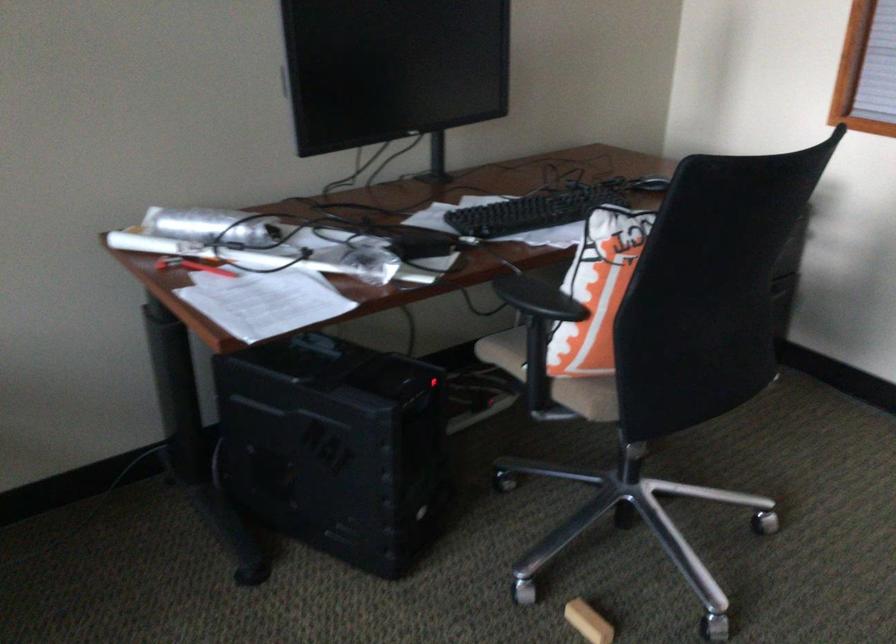
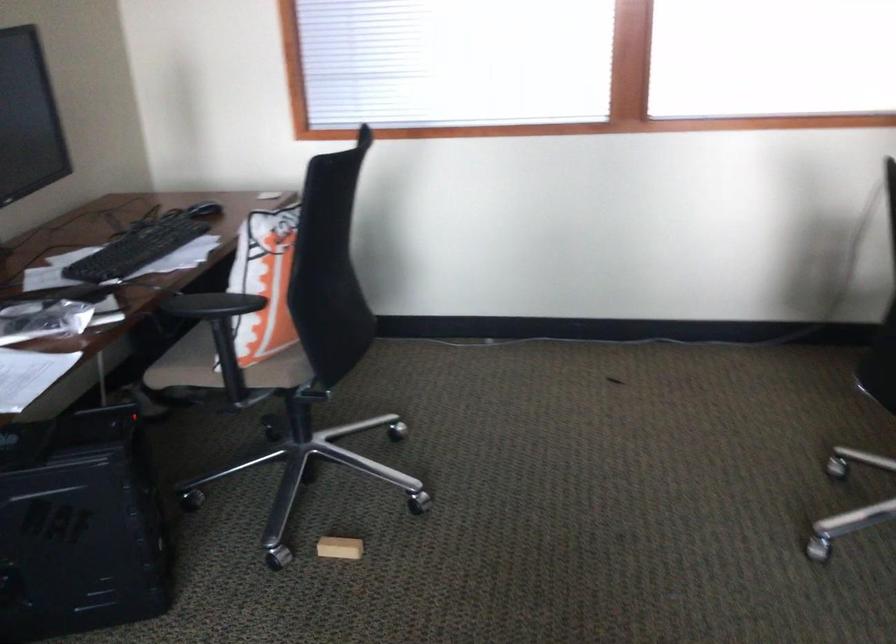
Question: The camera is either moving clockwise (left) or counter-clockwise (right) around the object. The first image is from the beginning of the video and the second image is from the end. Is the camera moving left or right when shooting the video?

Choices:
 (A) Left
 (B) Right

Answer: (A)